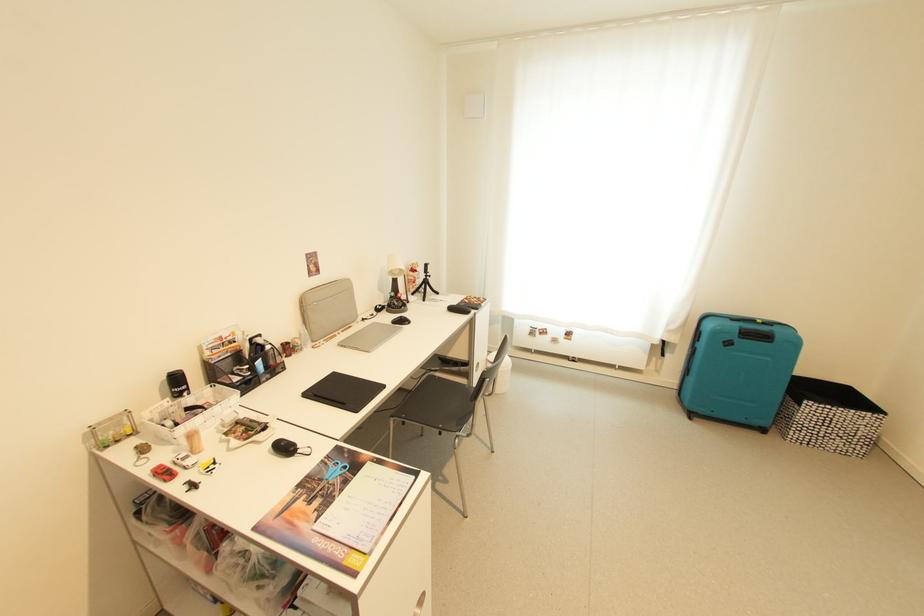
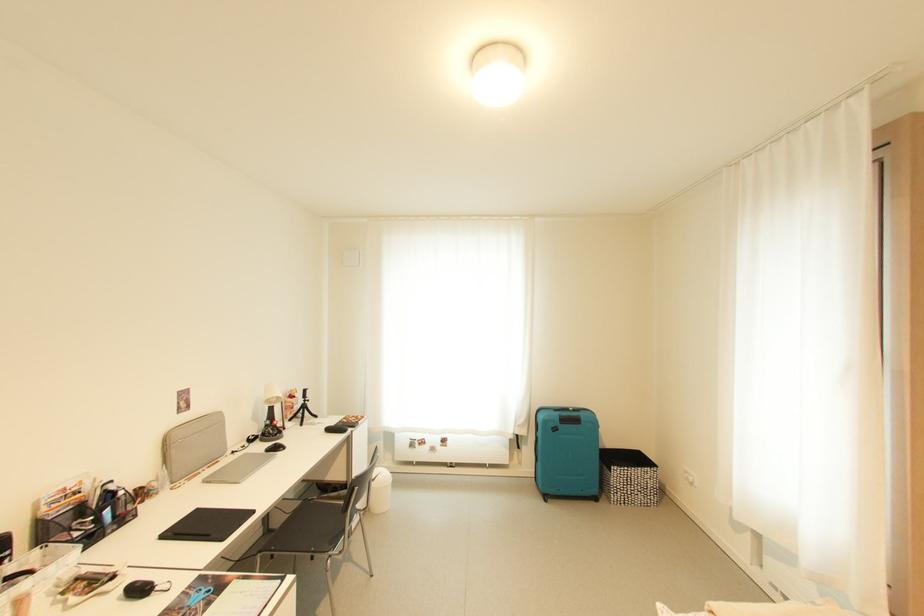
The point at (390, 304) is marked in the first image. Where is the corresponding point in the second image?

(262, 434)